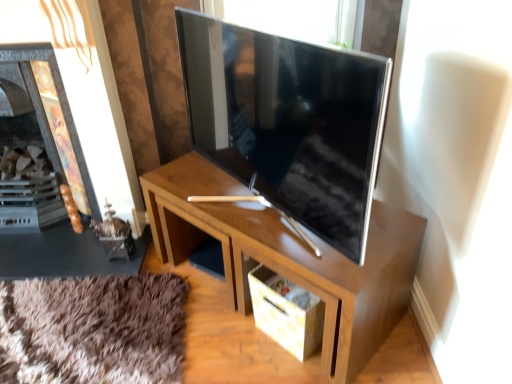
Where is `empty space that is in between wooden desk at center and matte cardboard drawer at lower center`? The image size is (512, 384). empty space that is in between wooden desk at center and matte cardboard drawer at lower center is located at coordinates click(225, 316).